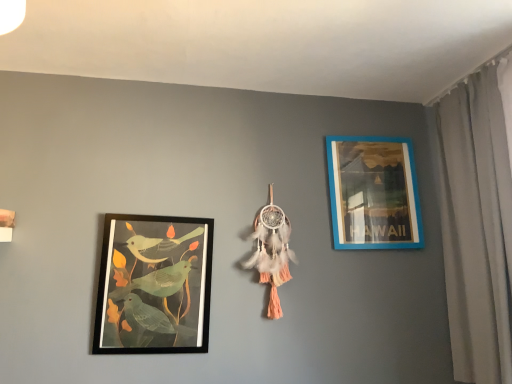
Question: Does matte black picture frame at left, the first picture frame viewed from the left, appear on the right side of blue plastic picture frame at upper right, arranged as the first picture frame when viewed from the right?

Choices:
 (A) no
 (B) yes

Answer: (A)

Question: Is matte black picture frame at left, which ranks as the first picture frame in front-to-back order, taller than blue plastic picture frame at upper right, arranged as the first picture frame when viewed from the right?

Choices:
 (A) yes
 (B) no

Answer: (A)

Question: Is matte black picture frame at left, arranged as the second picture frame when viewed from the right, thinner than blue plastic picture frame at upper right, which appears as the first picture frame when viewed from the back?

Choices:
 (A) no
 (B) yes

Answer: (A)

Question: Are matte black picture frame at left, which ranks as the first picture frame in front-to-back order, and blue plastic picture frame at upper right, arranged as the first picture frame when viewed from the right, beside each other?

Choices:
 (A) yes
 (B) no

Answer: (B)

Question: Does matte black picture frame at left, the first picture frame viewed from the left, have a greater width compared to blue plastic picture frame at upper right, the 2th picture frame positioned from the front?

Choices:
 (A) no
 (B) yes

Answer: (B)

Question: Is blue plastic picture frame at upper right, the 2th picture frame positioned from the front, to the left or to the right of matte black picture frame at left, which ranks as the first picture frame in front-to-back order, in the image?

Choices:
 (A) right
 (B) left

Answer: (A)

Question: From the image's perspective, is blue plastic picture frame at upper right, the 2th picture frame positioned from the front, located above or below matte black picture frame at left, which ranks as the first picture frame in front-to-back order?

Choices:
 (A) above
 (B) below

Answer: (A)

Question: Do you think blue plastic picture frame at upper right, arranged as the first picture frame when viewed from the right, is within matte black picture frame at left, which ranks as the first picture frame in front-to-back order, or outside of it?

Choices:
 (A) outside
 (B) inside

Answer: (A)

Question: Is blue plastic picture frame at upper right, which is counted as the 2th picture frame, starting from the left, taller or shorter than matte black picture frame at left, which ranks as the first picture frame in front-to-back order?

Choices:
 (A) tall
 (B) short

Answer: (B)

Question: Relative to blue plastic picture frame at upper right, which appears as the first picture frame when viewed from the back, is matte black picture frame at left, the second picture frame in the back-to-front sequence, in front or behind?

Choices:
 (A) front
 (B) behind

Answer: (A)

Question: Looking at the image, does matte black picture frame at left, the second picture frame in the back-to-front sequence, seem bigger or smaller compared to blue plastic picture frame at upper right, the 2th picture frame positioned from the front?

Choices:
 (A) small
 (B) big

Answer: (B)

Question: Considering the positions of matte black picture frame at left, the first picture frame viewed from the left, and blue plastic picture frame at upper right, which is counted as the 2th picture frame, starting from the left, in the image, is matte black picture frame at left, the first picture frame viewed from the left, wider or thinner than blue plastic picture frame at upper right, which is counted as the 2th picture frame, starting from the left,?

Choices:
 (A) thin
 (B) wide

Answer: (B)

Question: Is matte black picture frame at left, the first picture frame viewed from the left, to the left or to the right of blue plastic picture frame at upper right, arranged as the first picture frame when viewed from the right, in the image?

Choices:
 (A) left
 (B) right

Answer: (A)

Question: Is white fabric curtain at right taller or shorter than matte black picture frame at left, the first picture frame viewed from the left?

Choices:
 (A) tall
 (B) short

Answer: (A)

Question: Based on their sizes in the image, would you say white fabric curtain at right is bigger or smaller than matte black picture frame at left, the first picture frame viewed from the left?

Choices:
 (A) small
 (B) big

Answer: (B)